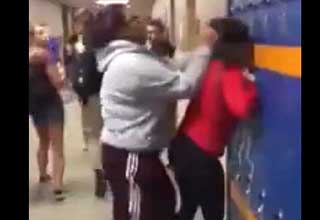
The height and width of the screenshot is (220, 320). Find the location of `lock`. lock is located at coordinates point(263,195).